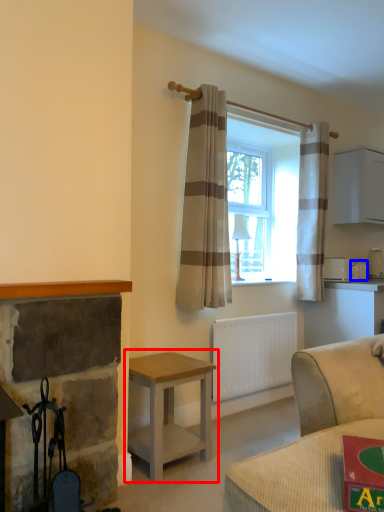
Question: Which of the following is the farthest to the observer, table (highlighted by a red box) or appliance (highlighted by a blue box)?

Choices:
 (A) table
 (B) appliance

Answer: (B)